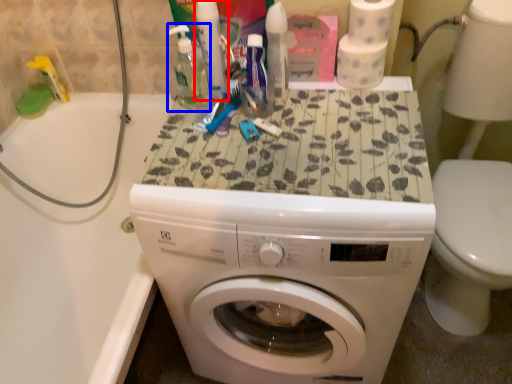
Question: Among these objects, which one is farthest to the camera, toiletry (highlighted by a red box) or cleaning product (highlighted by a blue box)?

Choices:
 (A) toiletry
 (B) cleaning product

Answer: (A)